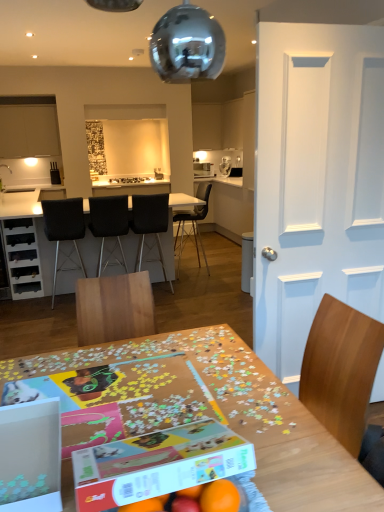
Find the location of a particular element. The width and height of the screenshot is (384, 512). free spot to the right of orange matte at lower center is located at coordinates (297, 490).